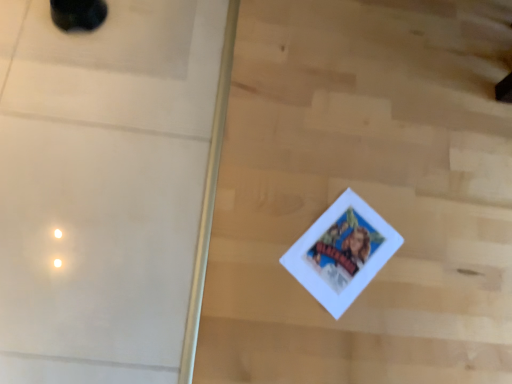
Question: Is black rubber shoe at upper left wider than white glossy screen door at upper left?

Choices:
 (A) no
 (B) yes

Answer: (A)

Question: Is black rubber shoe at upper left positioned before white glossy screen door at upper left?

Choices:
 (A) yes
 (B) no

Answer: (B)

Question: From a real-world perspective, is black rubber shoe at upper left over white glossy screen door at upper left?

Choices:
 (A) yes
 (B) no

Answer: (A)

Question: Is black rubber shoe at upper left oriented towards white glossy screen door at upper left?

Choices:
 (A) yes
 (B) no

Answer: (A)

Question: Does black rubber shoe at upper left contain white glossy screen door at upper left?

Choices:
 (A) yes
 (B) no

Answer: (B)

Question: From the image's perspective, is black rubber shoe at upper left beneath white glossy screen door at upper left?

Choices:
 (A) yes
 (B) no

Answer: (B)

Question: Is black rubber shoe at upper left at the back of white glossy screen door at upper left?

Choices:
 (A) yes
 (B) no

Answer: (B)

Question: Considering the relative sizes of white glossy screen door at upper left and black rubber shoe at upper left in the image provided, is white glossy screen door at upper left taller than black rubber shoe at upper left?

Choices:
 (A) no
 (B) yes

Answer: (A)

Question: From a real-world perspective, is white glossy screen door at upper left over black rubber shoe at upper left?

Choices:
 (A) yes
 (B) no

Answer: (B)

Question: Considering the relative sizes of white glossy screen door at upper left and black rubber shoe at upper left in the image provided, is white glossy screen door at upper left smaller than black rubber shoe at upper left?

Choices:
 (A) yes
 (B) no

Answer: (B)

Question: Is white glossy screen door at upper left beside black rubber shoe at upper left?

Choices:
 (A) no
 (B) yes

Answer: (A)

Question: Is black rubber shoe at upper left surrounded by white glossy screen door at upper left?

Choices:
 (A) yes
 (B) no

Answer: (B)

Question: Considering the positions of point (0, 102) and point (69, 11), is point (0, 102) closer or farther from the camera than point (69, 11)?

Choices:
 (A) farther
 (B) closer

Answer: (B)